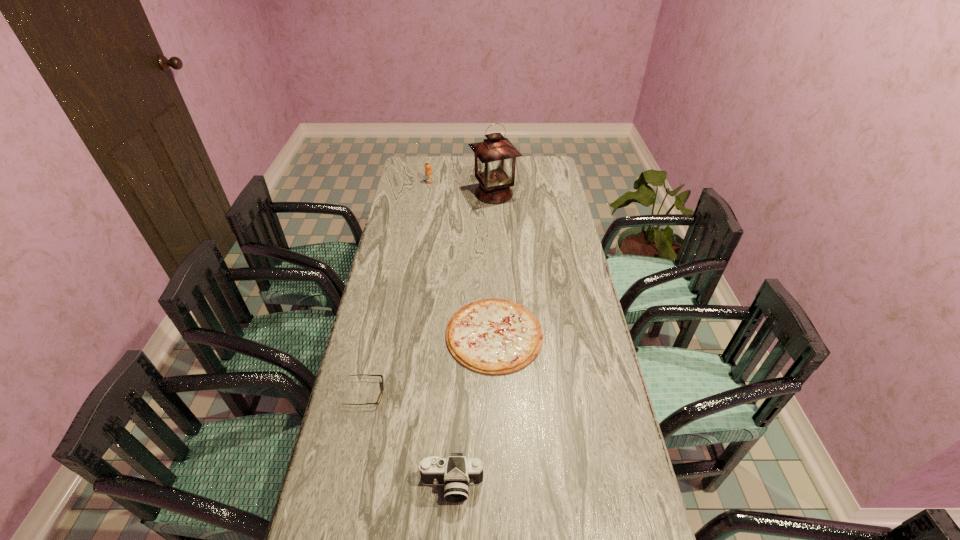
At what (x,y) coordinates should I click in order to perform the action: click on oil lamp. Please return your answer as a coordinate pair (x, y). This screenshot has width=960, height=540. Looking at the image, I should click on (494, 159).

Where is `orange juice`? This screenshot has width=960, height=540. orange juice is located at coordinates (428, 172).

In order to click on camera in this screenshot , I will do `click(456, 472)`.

The height and width of the screenshot is (540, 960). I want to click on the leftmost object, so click(x=380, y=397).

I want to click on sunglasses, so click(x=380, y=397).

Find the location of a particular element. Image resolution: width=960 pixels, height=540 pixels. the third farthest object is located at coordinates (491, 336).

You are a GUI agent. You are given a task and a screenshot of the screen. Output one action in this format:
    pyautogui.click(x=<x>, y=<y>)
    Task: Click on the shortest object
    The image size is (960, 540).
    Given the screenshot: What is the action you would take?
    pyautogui.click(x=491, y=336)

Where is `vacant region located 0.130m on the right of the tallest object`? The width and height of the screenshot is (960, 540). vacant region located 0.130m on the right of the tallest object is located at coordinates (546, 194).

Find the location of `vacant space situated on the front label of the orange juice`. vacant space situated on the front label of the orange juice is located at coordinates (425, 211).

The height and width of the screenshot is (540, 960). In order to click on vacant region located 0.220m on the back of the camera in this screenshot , I will do `click(456, 394)`.